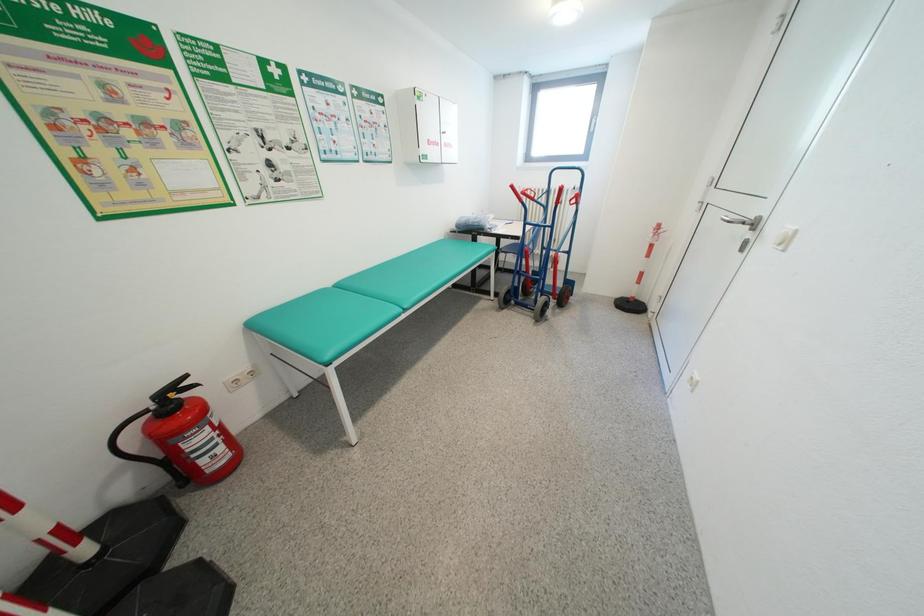
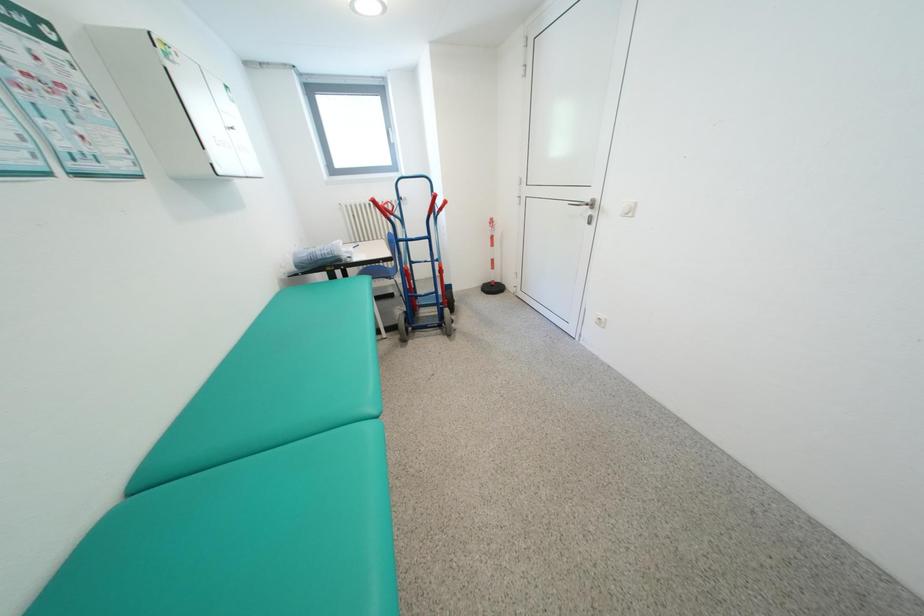
Question: The first image is from the beginning of the video and the second image is from the end. How did the camera likely rotate when shooting the video?

Choices:
 (A) Left
 (B) Right
 (C) Up
 (D) Down

Answer: (B)